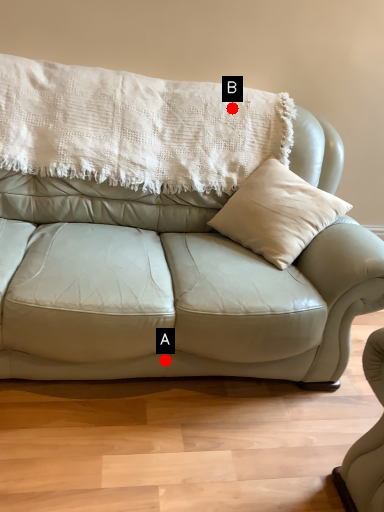
Question: Two points are circled on the image, labeled by A and B beside each circle. Which point appears closest to the camera in this image?

Choices:
 (A) A is closer
 (B) B is closer

Answer: (A)